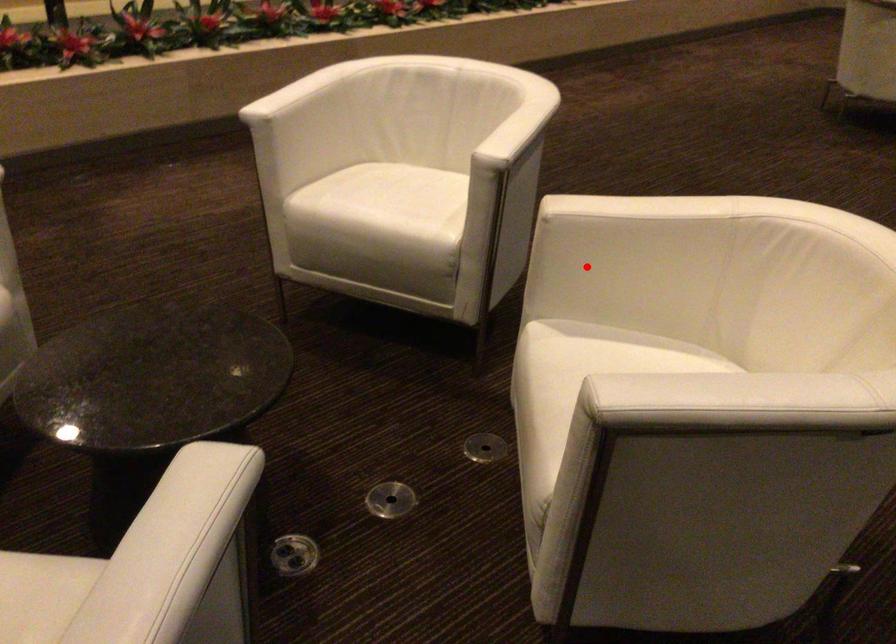
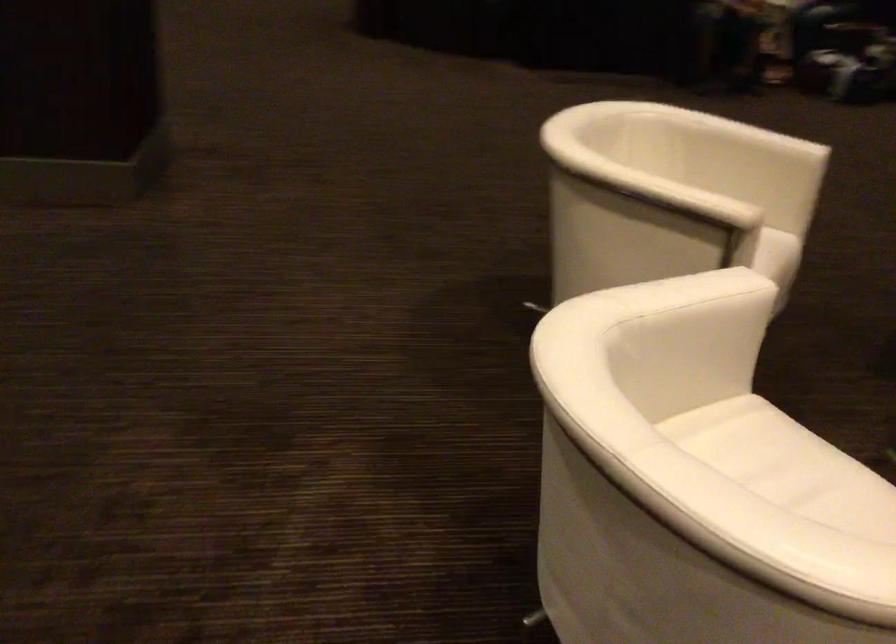
Where in the second image is the point corresponding to the highlighted location from the first image?

(676, 261)